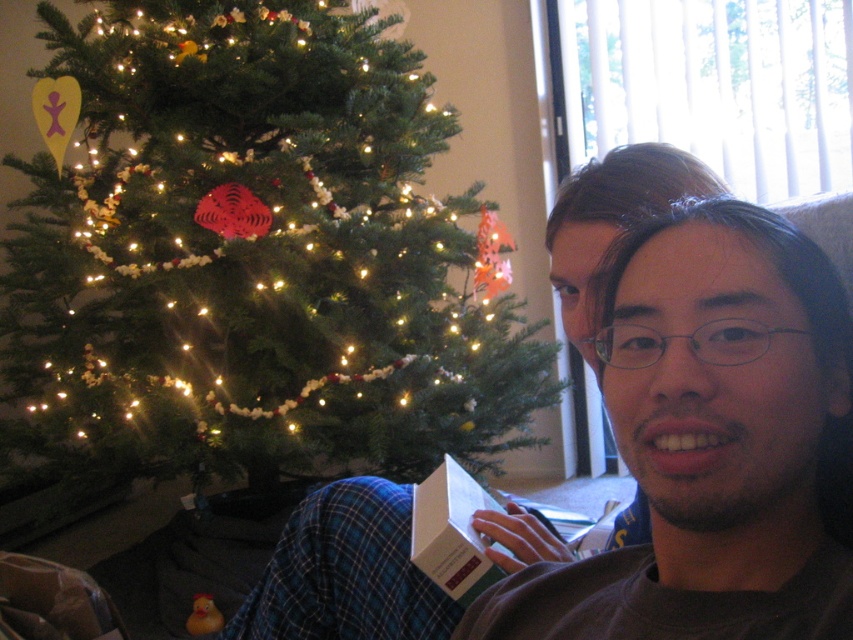
Question: Does green matte christmas tree at center appear under matte brown box at lower center?

Choices:
 (A) no
 (B) yes

Answer: (A)

Question: Among these objects, which one is farthest from the camera?

Choices:
 (A) matte brown box at lower center
 (B) green matte christmas tree at center

Answer: (B)

Question: Is green matte christmas tree at center positioned behind matte brown box at lower center?

Choices:
 (A) no
 (B) yes

Answer: (B)

Question: Is green matte christmas tree at center positioned before matte brown box at lower center?

Choices:
 (A) yes
 (B) no

Answer: (B)

Question: Among these points, which one is farthest from the camera?

Choices:
 (A) (47, 67)
 (B) (485, 554)

Answer: (A)